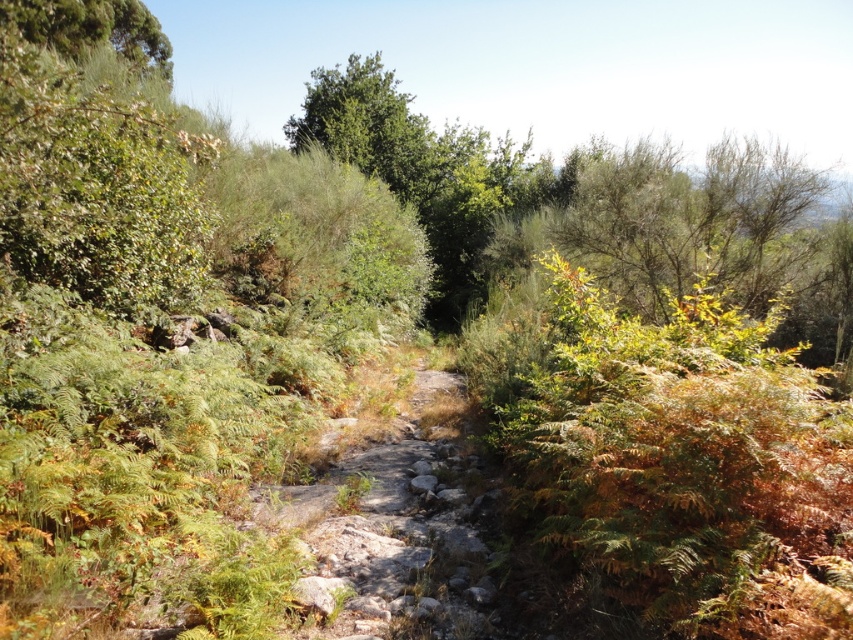
You are a hiker carrying a 2.5 feet wide backpack and want to walk along the gray rocky trail at center. There is also a green leafy bush at upper right nearby. Can the backpack fit through the trail without touching the bush?

The gray rocky trail at center has a lesser width compared to green leafy bush at upper right. Since the trail is narrower than the bush, the backpack might not fit through without touching the bush. Check the actual width before proceeding.

You are a hiker standing at the start of the gray rocky trail at center and want to reach the green leafy tree at upper left. Which direction should you walk to get closer to the tree?

The gray rocky trail at center is closer to the viewer than the green leafy tree at upper left. To reach the tree, you should walk forward along the gray rocky trail at center towards the upper left direction.